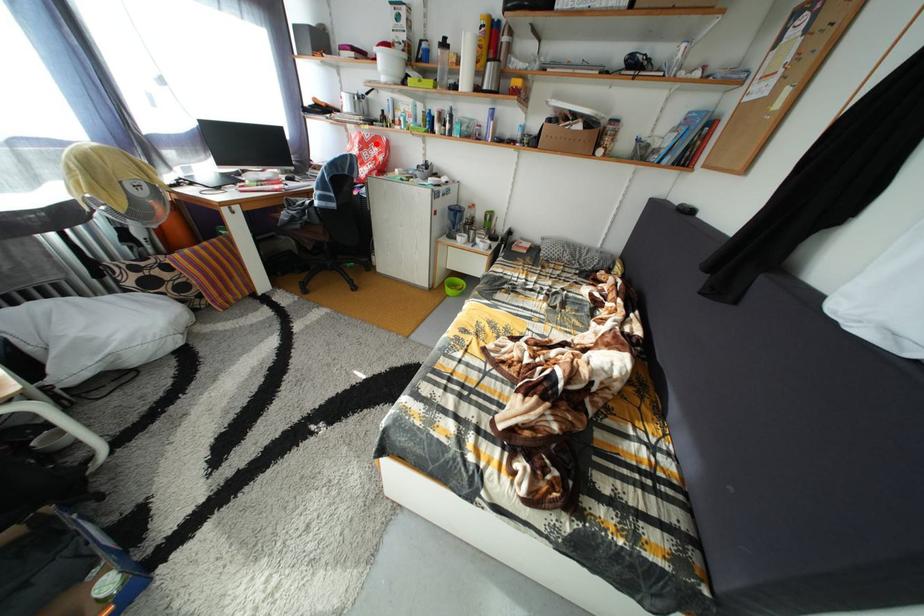
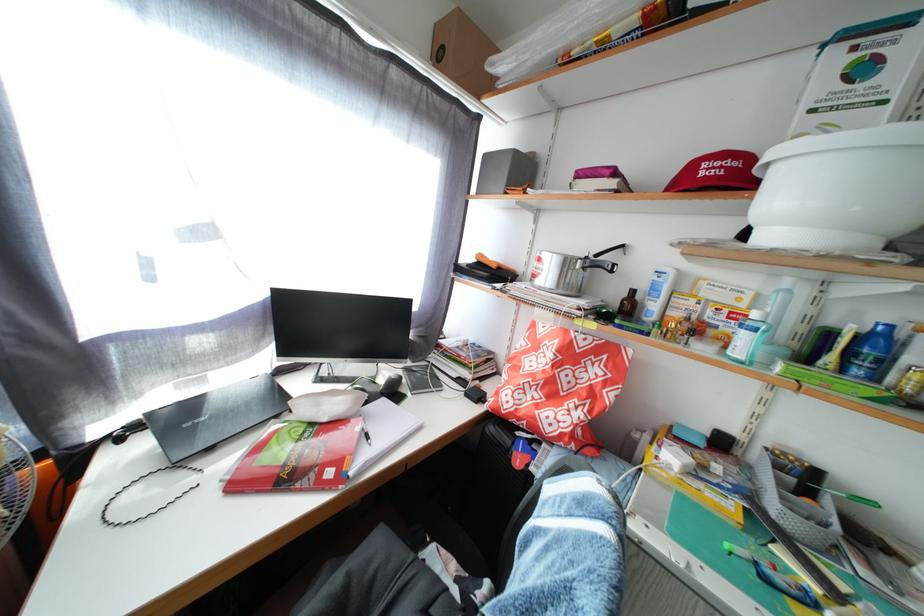
Find the pixel in the second image that matches the highlighted location in the first image.

(590, 350)